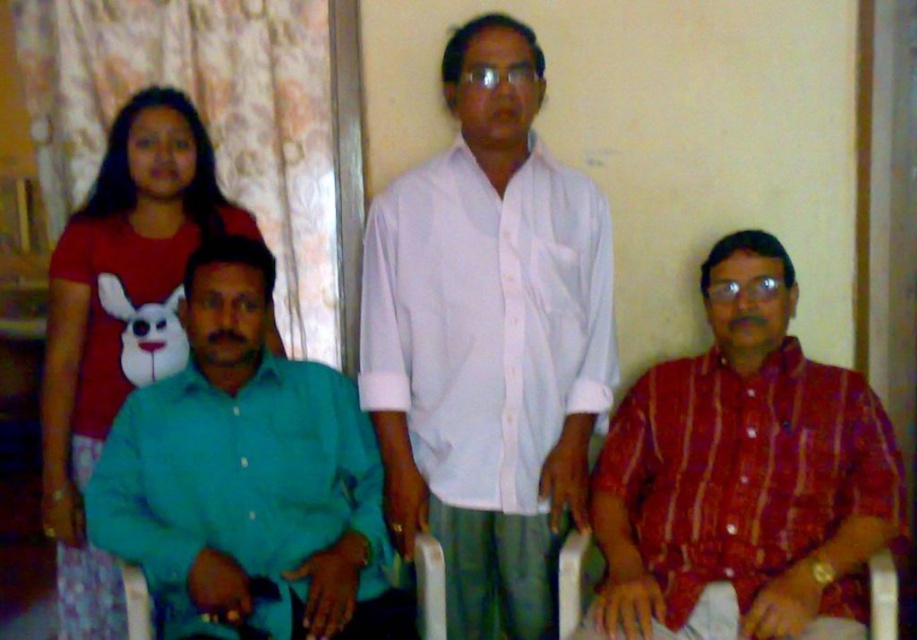
Consider the image. Who is more distant from viewer, (x=337, y=529) or (x=94, y=408)?

The point (x=94, y=408) is more distant.

Can you confirm if teal matte shirt at lower left is wider than teal cotton shirt at left?

Indeed, teal matte shirt at lower left has a greater width compared to teal cotton shirt at left.

Is point (301, 563) positioned before point (109, 596)?

Yes, it is.

At what (x,y) coordinates should I click in order to perform the action: click on teal matte shirt at lower left. Please return your answer as a coordinate pair (x, y). Looking at the image, I should click on 247,480.

Is white cotton shirt at center further to the viewer compared to striped cotton shirt at right?

Yes.

Who is higher up, white cotton shirt at center or striped cotton shirt at right?

white cotton shirt at center is above.

Where is `white cotton shirt at center`? This screenshot has width=917, height=640. white cotton shirt at center is located at coordinates (488, 340).

Identify the location of white cotton shirt at center. This screenshot has height=640, width=917. (488, 340).

In the scene shown: Can you confirm if striped cotton shirt at right is bigger than teal matte shirt at lower left?

Yes.

Can you confirm if striped cotton shirt at right is positioned below teal matte shirt at lower left?

Actually, striped cotton shirt at right is above teal matte shirt at lower left.

Who is more forward, (617, 467) or (356, 445)?

Point (356, 445) is more forward.

Locate an element on the screen. Image resolution: width=917 pixels, height=640 pixels. striped cotton shirt at right is located at coordinates (744, 468).